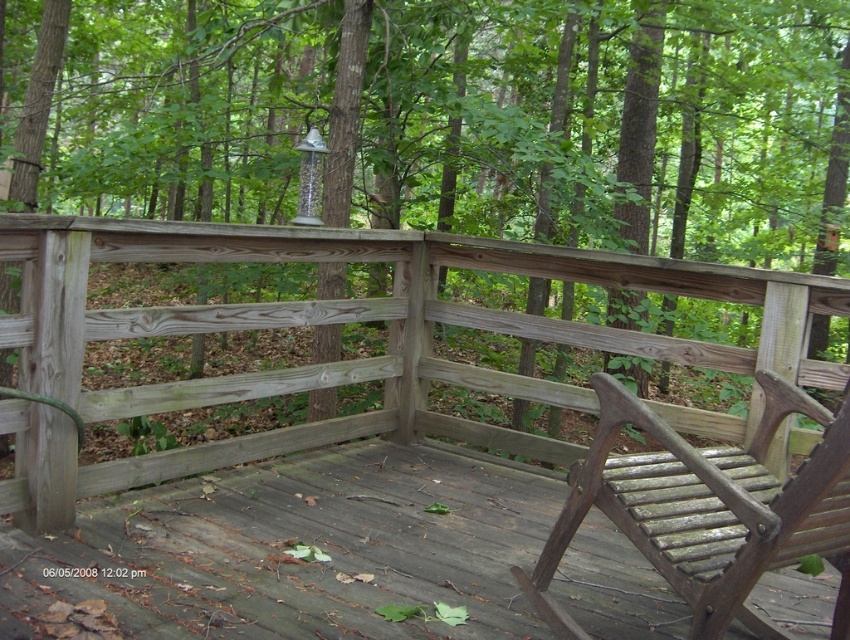
You are a maintenance worker who needs to move a 1.2 meter wide tool cart from the wooden slats chair at lower right to the weathered wood porch at center. Can the cart fit through the space between them?

The distance between the weathered wood porch at center and the wooden slats chair at lower right is 1.33 meters. Since the tool cart is 1.2 meters wide, it can fit through the space as there is enough clearance.

You are standing on the wooden deck surrounded by a dense forest. There is a brown wood tree at center. Can you tell me what is located at the coordinate point (469, 138) on the deck?

At point (469, 138) lies brown wood tree at center.

You are planning to place a new rectangular table on the deck. The table is as wide as the wooden slats chair at lower right. Will the weathered wood porch at center have enough space to accommodate this table without overlapping the chair?

The weathered wood porch at center has a larger width than the wooden slats chair at lower right. Since the table is as wide as the chair, the porch should have enough space to accommodate the table without overlapping the chair.